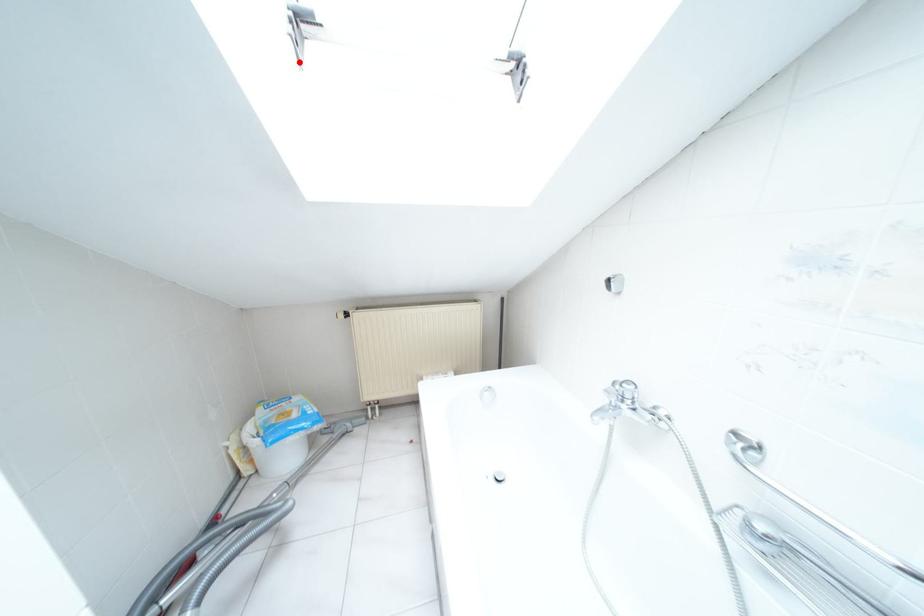
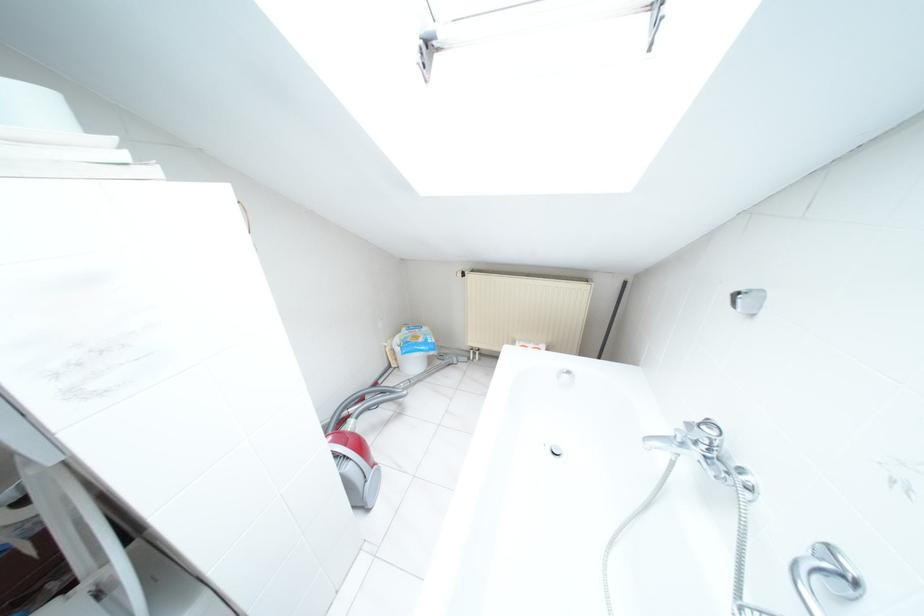
Locate, in the second image, the point that corresponds to the highlighted location in the first image.

(426, 81)